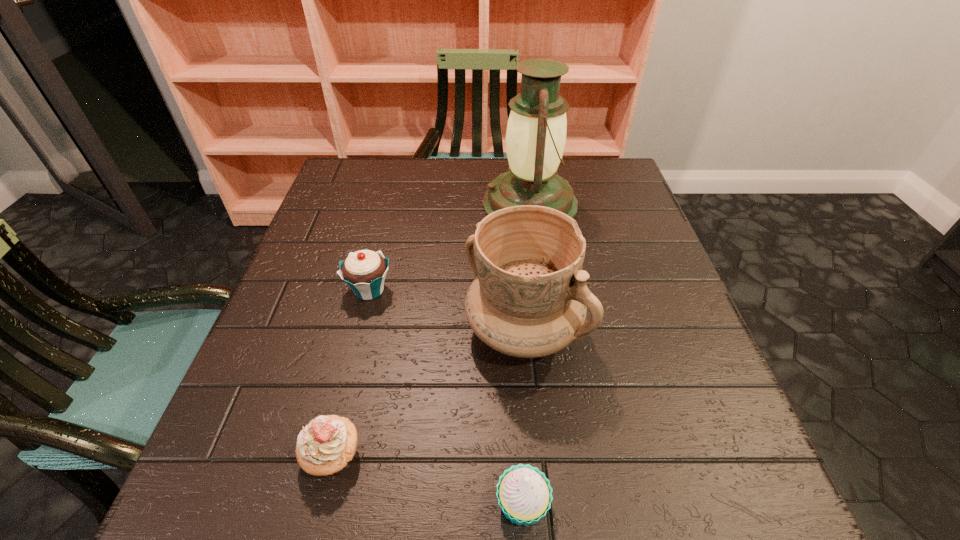
The width and height of the screenshot is (960, 540). I want to click on object that can be found as the third closest to the shortest object, so click(364, 271).

Where is `the closest cupcake to the fourth shortest object`? the closest cupcake to the fourth shortest object is located at coordinates (364, 271).

Identify which cupcake is the closest to the lantern. Please provide its 2D coordinates. Your answer should be formatted as a tuple, i.e. [(x, y)], where the tuple contains the x and y coordinates of a point satisfying the conditions above.

[(364, 271)]